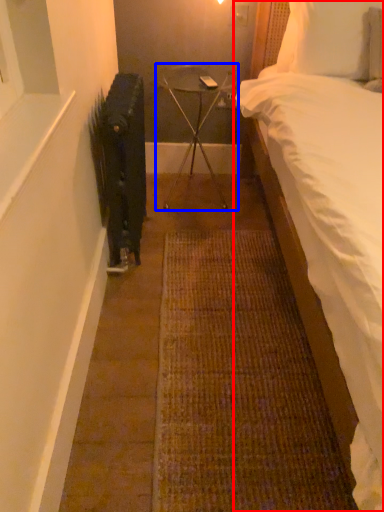
Question: Which object is closer to the camera taking this photo, bed (highlighted by a red box) or furniture (highlighted by a blue box)?

Choices:
 (A) bed
 (B) furniture

Answer: (A)